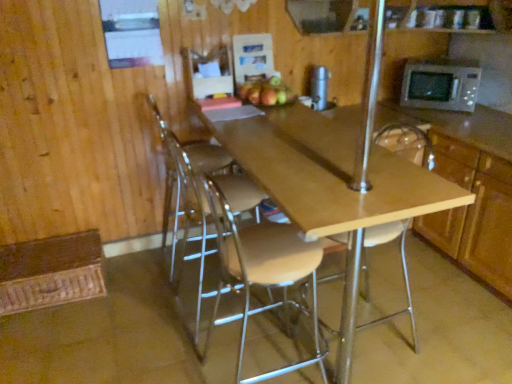
Where is `vacant space in between light brown wood stool at center, positioned as the second chair in left-to-right order, and brown woven mat at lower left`? vacant space in between light brown wood stool at center, positioned as the second chair in left-to-right order, and brown woven mat at lower left is located at coordinates (133, 326).